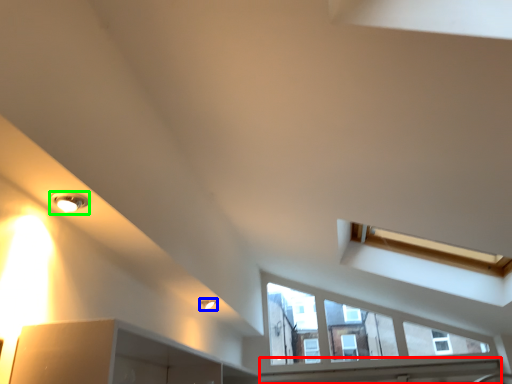
Question: Which object is the farthest from window sill (highlighted by a red box)? Choose among these: light fixture (highlighted by a blue box) or light fixture (highlighted by a green box).

Choices:
 (A) light fixture
 (B) light fixture

Answer: (B)